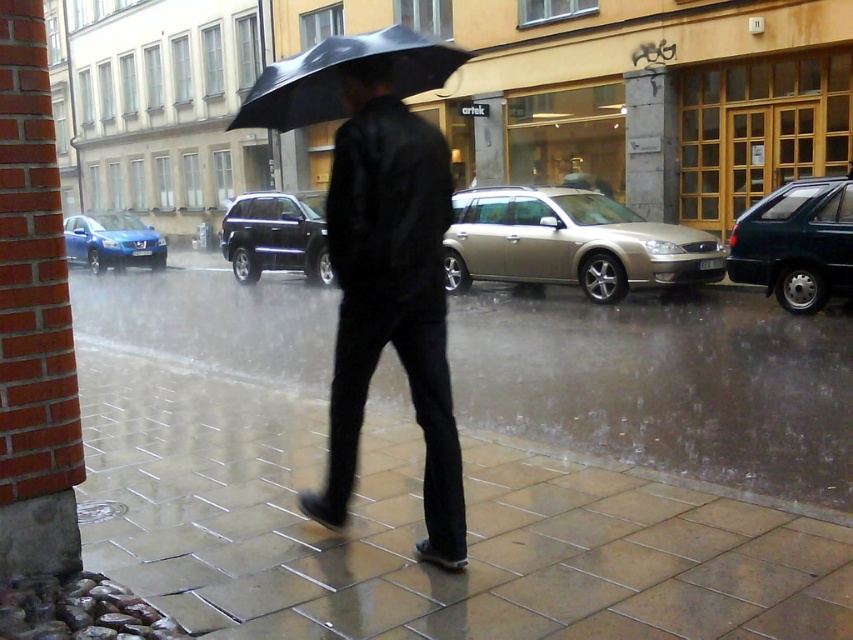
Which of these two, gold metallic station wagon at center or black matte umbrella at center, stands taller?

With more height is black matte umbrella at center.

Does point (634, 232) lie behind point (405, 29)?

Yes, it is.

Image resolution: width=853 pixels, height=640 pixels. In order to click on gold metallic station wagon at center in this screenshot , I will do `click(570, 243)`.

Can you confirm if matte black jacket at center is positioned below teal matte suv at right?

Correct, matte black jacket at center is located below teal matte suv at right.

Between matte black jacket at center and teal matte suv at right, which one appears on the right side from the viewer's perspective?

From the viewer's perspective, teal matte suv at right appears more on the right side.

Between point (437, 182) and point (808, 189), which one is positioned in front?

Positioned in front is point (437, 182).

Identify the location of matte black jacket at center. pos(390,296).

Is gold metallic station wagon at center shorter than teal matte suv at right?

No.

Is gold metallic station wagon at center bigger than teal matte suv at right?

Yes.

Is point (688, 236) more distant than point (756, 248)?

Yes, point (688, 236) is farther from viewer.

Locate an element on the screen. This screenshot has height=640, width=853. gold metallic station wagon at center is located at coordinates (570, 243).